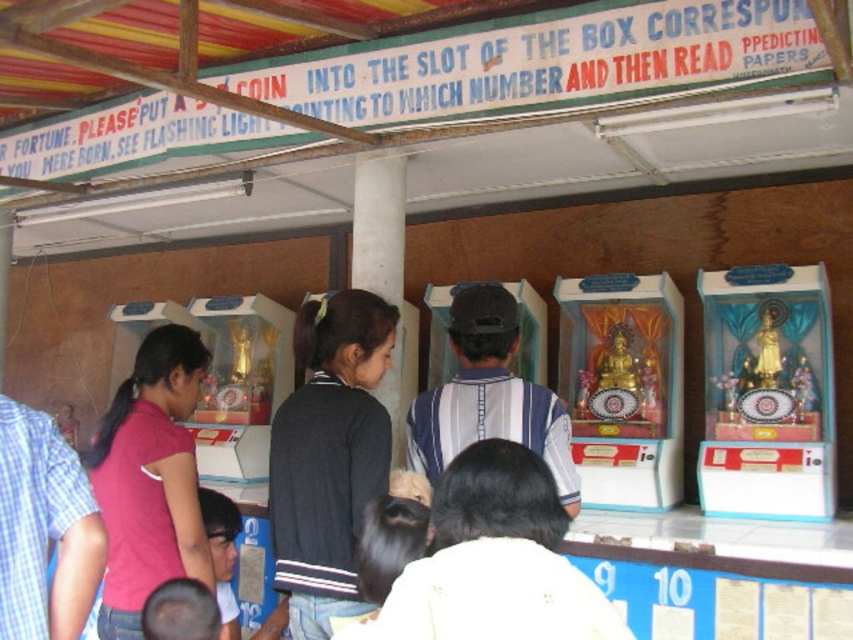
Question: Is gold metallic statue at center right thinner than gold shiny statue at center?

Choices:
 (A) no
 (B) yes

Answer: (A)

Question: Which object is the closest to the black sweater at center?

Choices:
 (A) dark gray sweater at center
 (B) gold shiny statue at center
 (C) blue plaid shirt at lower left
 (D) pink fabric shirt at left

Answer: (A)

Question: Can you confirm if gold metallic statue at center right is thinner than dark gray sweater at center?

Choices:
 (A) yes
 (B) no

Answer: (B)

Question: Which object is positioned farthest from the gold shiny statue at center?

Choices:
 (A) black sweater at center
 (B) pink fabric shirt at left

Answer: (A)

Question: Estimate the real-world distances between objects in this image. Which object is closer to the dark gray sweater at center?

Choices:
 (A) blue plaid shirt at lower left
 (B) striped fabric shirt at center
 (C) black sweater at center
 (D) pink fabric shirt at left

Answer: (B)

Question: From the image, what is the correct spatial relationship of gold metallic statue at center right in relation to pink fabric shirt at left?

Choices:
 (A) below
 (B) above

Answer: (B)